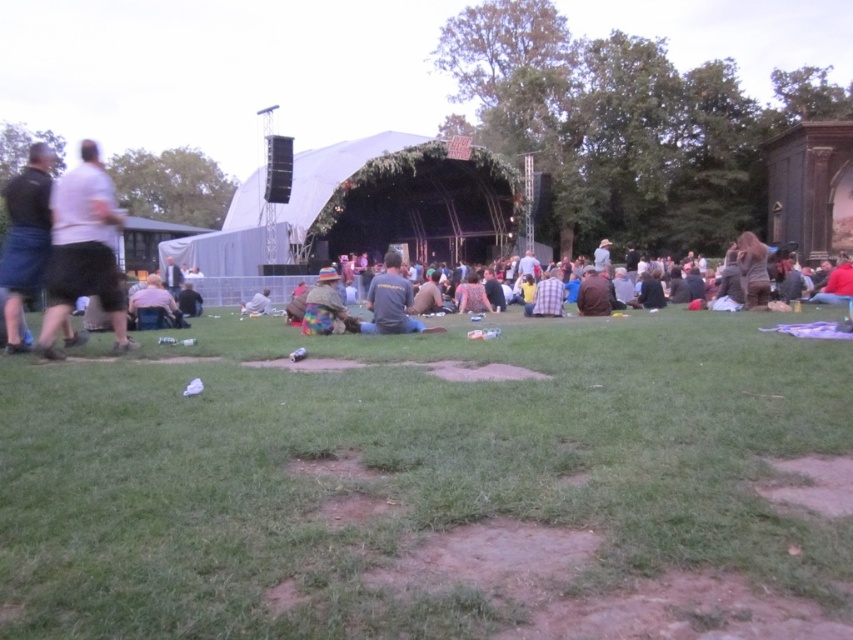
You are a photographer trying to capture a clear shot of the green grass at lower center without the denim shorts at left blocking the view. Based on their positions, is this possible?

The green grass at lower center is in front of the denim shorts at left, so it is possible to capture a clear shot of the green grass at lower center without the denim shorts at left blocking the view since the grass is closer to the camera.

You are standing at the origin point of the coordinate system in the image. You want to pick up the light gray cotton shorts at left. In which direction should you move to reach them?

The light gray cotton shorts at left are located at coordinate point 0.391 on the x axis and 0.098 on the y axis. Since you are at the origin, you should move to the right along the x axis and slightly downward along the y axis to reach them.

You are a photographer trying to capture a clear shot of the stage from the grassy area. You notice the green grass at lower center and denim shorts at left in your frame. Which object is taller and might block your view?

The denim shorts at left are taller than the green grass at lower center, so they might block your view.